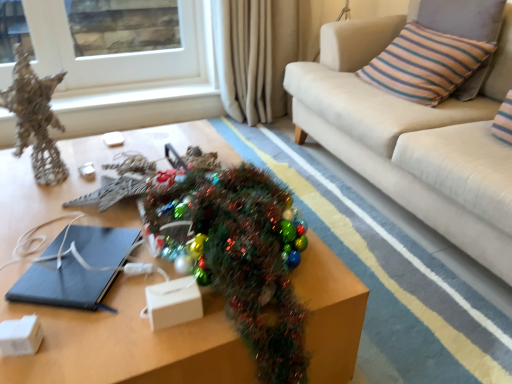
Where is `vacant space underneath metallic wire sculpture at left (from a real-world perspective)`? This screenshot has width=512, height=384. vacant space underneath metallic wire sculpture at left (from a real-world perspective) is located at coordinates (37, 183).